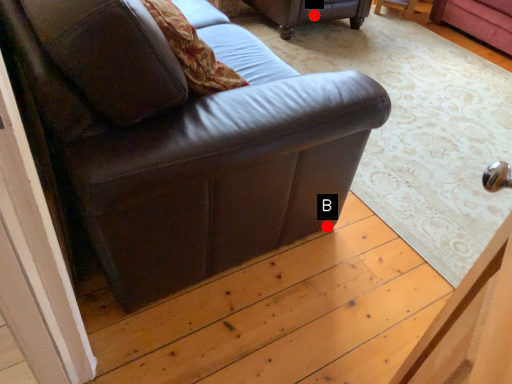
Question: Two points are circled on the image, labeled by A and B beside each circle. Among these points, which one is farthest from the camera?

Choices:
 (A) A is further
 (B) B is further

Answer: (A)